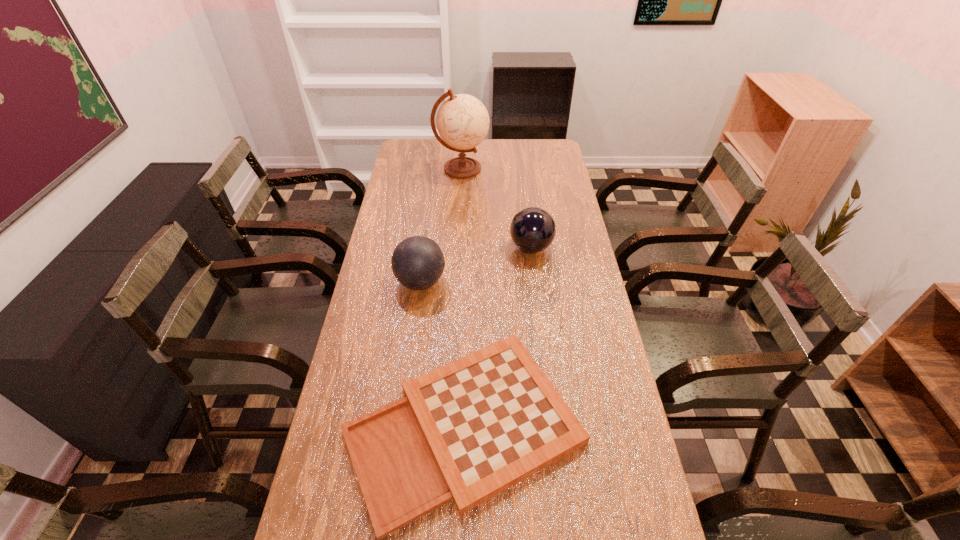
Where is `the farthest object`? The image size is (960, 540). the farthest object is located at coordinates (462, 121).

This screenshot has width=960, height=540. Identify the location of globe. (462, 121).

Where is `the left bowling ball`? The height and width of the screenshot is (540, 960). the left bowling ball is located at coordinates [x=417, y=262].

Image resolution: width=960 pixels, height=540 pixels. I want to click on the nearer bowling ball, so click(x=417, y=262).

At what (x,y) coordinates should I click in order to perform the action: click on the third nearest object. Please return your answer as a coordinate pair (x, y). Looking at the image, I should click on (533, 229).

In order to click on the right bowling ball in this screenshot , I will do `click(533, 229)`.

Where is `free space located on the surface of the globe`? This screenshot has height=540, width=960. free space located on the surface of the globe is located at coordinates (543, 169).

I want to click on free space located on the grip area of the second nearest object, so click(465, 281).

This screenshot has width=960, height=540. What are the coordinates of `vacant space located 0.210m on the side of the farther bowling ball with the finger holes` in the screenshot? It's located at (450, 247).

Where is `vacant position located 0.390m on the side of the farther bowling ball with the finger holes`? This screenshot has width=960, height=540. vacant position located 0.390m on the side of the farther bowling ball with the finger holes is located at coordinates coord(400,247).